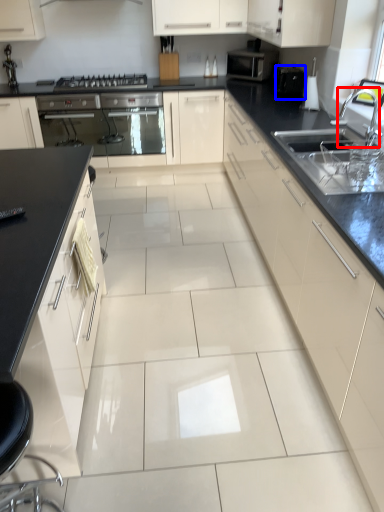
Question: Which object appears farthest to the camera in this image, faucet (highlighted by a red box) or appliance (highlighted by a blue box)?

Choices:
 (A) faucet
 (B) appliance

Answer: (B)